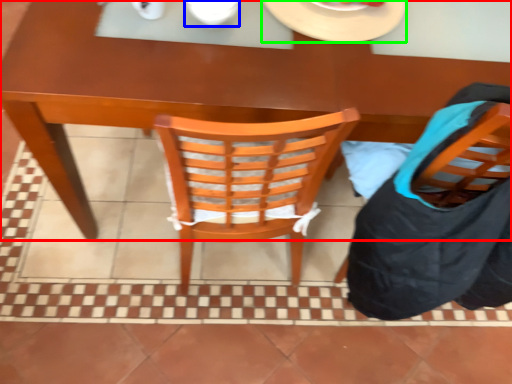
Question: Which object is the closest to the desk (highlighted by a red box)? Choose among these: tableware (highlighted by a blue box) or plate (highlighted by a green box).

Choices:
 (A) tableware
 (B) plate

Answer: (B)